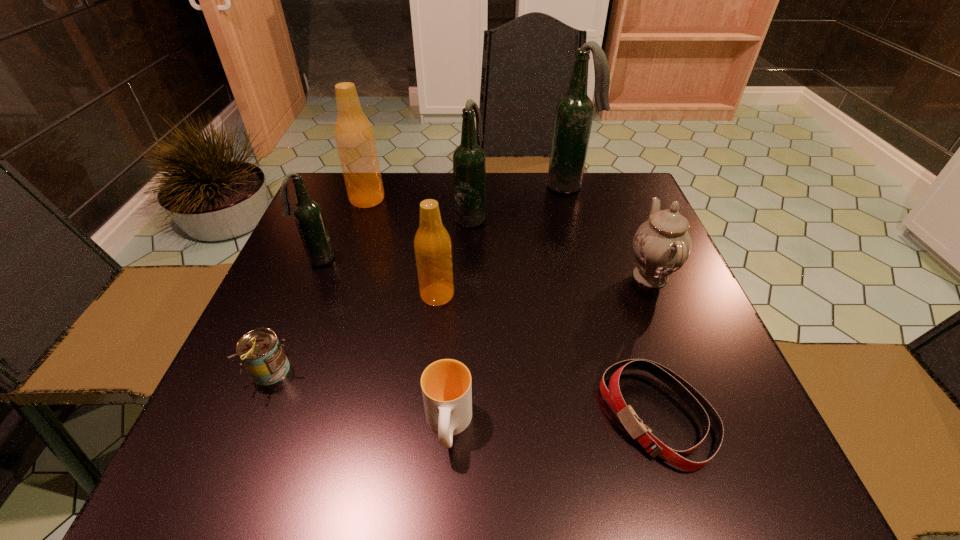
Image resolution: width=960 pixels, height=540 pixels. I want to click on chinaware at the right edge, so click(x=661, y=245).

I want to click on dog collar that is at the right edge, so click(706, 414).

Locate an element on the screen. object that is at the far left corner is located at coordinates (354, 136).

Identify the location of object that is at the far right corner. (574, 112).

The height and width of the screenshot is (540, 960). What are the coordinates of `object present at the near right corner` in the screenshot? It's located at (706, 414).

Identify the location of vacant space at the far edge of the desktop. This screenshot has height=540, width=960. (514, 195).

This screenshot has width=960, height=540. In order to click on blank space at the near edge of the desktop in this screenshot , I will do `click(660, 468)`.

The width and height of the screenshot is (960, 540). What are the coordinates of `vacant area at the left edge of the desktop` in the screenshot? It's located at (293, 316).

Find the location of a particular element. vacant space at the right edge of the desktop is located at coordinates (664, 337).

The width and height of the screenshot is (960, 540). In order to click on free space at the far left corner of the desktop in this screenshot , I will do `click(336, 215)`.